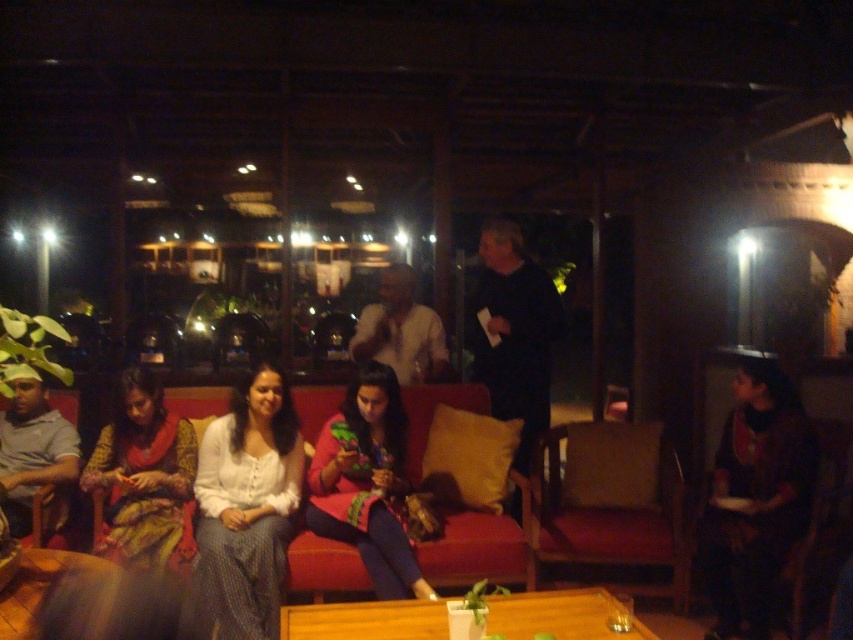
Does point (137, 401) come farther from viewer compared to point (368, 637)?

Yes, point (137, 401) is behind point (368, 637).

Between printed silk saree at center and wooden table at center, which one is positioned higher?

Positioned higher is printed silk saree at center.

Does point (172, 454) come in front of point (541, 602)?

That is False.

Identify the location of printed silk saree at center. The image size is (853, 640). (144, 477).

Between velvet cushion at center and wooden table at lower left, which one is positioned lower?

velvet cushion at center is lower down.

Who is more forward, (543, 561) or (12, 636)?

Point (12, 636) is in front.

Where is `velvet cushion at center`? velvet cushion at center is located at coordinates tap(611, 500).

Where is `velvet cushion at center`? velvet cushion at center is located at coordinates (611, 500).

Looking at this image, who is positioned more to the right, velvet cushion at center or wooden table at center?

From the viewer's perspective, velvet cushion at center appears more on the right side.

You are a GUI agent. You are given a task and a screenshot of the screen. Output one action in this format:
    pyautogui.click(x=<x>, y=<y>)
    Task: Click on the velvet cushion at center
    The image size is (853, 640).
    Given the screenshot: What is the action you would take?
    (x=611, y=500)